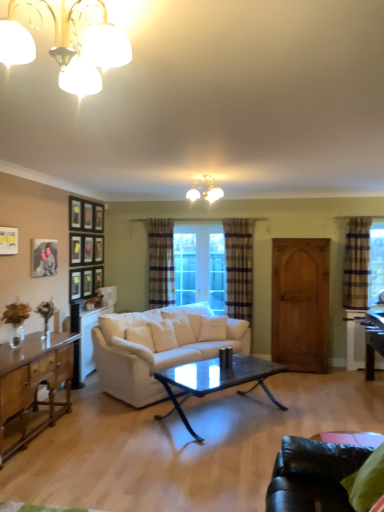
Question: Considering the positions of plaid fabric curtain at center, placed as the second curtain when sorted from back to front, and plaid fabric curtain at center, which is the 3th curtain from front to back, in the image, is plaid fabric curtain at center, placed as the second curtain when sorted from back to front, wider or thinner than plaid fabric curtain at center, which is the 3th curtain from front to back,?

Choices:
 (A) thin
 (B) wide

Answer: (A)

Question: Is point (248, 287) positioned closer to the camera than point (158, 260)?

Choices:
 (A) farther
 (B) closer

Answer: (B)

Question: Which object is the farthest from the matte black picture frame at upper left, the second picture frame when ordered from right to left?

Choices:
 (A) white fabric couch at center
 (B) wooden armoire at right
 (C) matte black picture frame at upper left, the 4th picture frame positioned from the right
 (D) matte glass chandelier at upper left, which appears as the 1th lamp when viewed from the left
 (E) matte black picture frame at upper left, the 3th picture frame when ordered from back to front

Answer: (D)

Question: Based on their relative distances, which object is nearer to the black glass coffee table at center?

Choices:
 (A) plaid fabric curtain at center, placed as the second curtain when sorted from back to front
 (B) matte black picture frame at upper left, the third picture frame from the right
 (C) matte white chandelier at upper center, the first lamp viewed from the right
 (D) wooden picture frame at upper left, which is the fourth picture frame from left to right
 (E) wooden cabinet at left

Answer: (E)